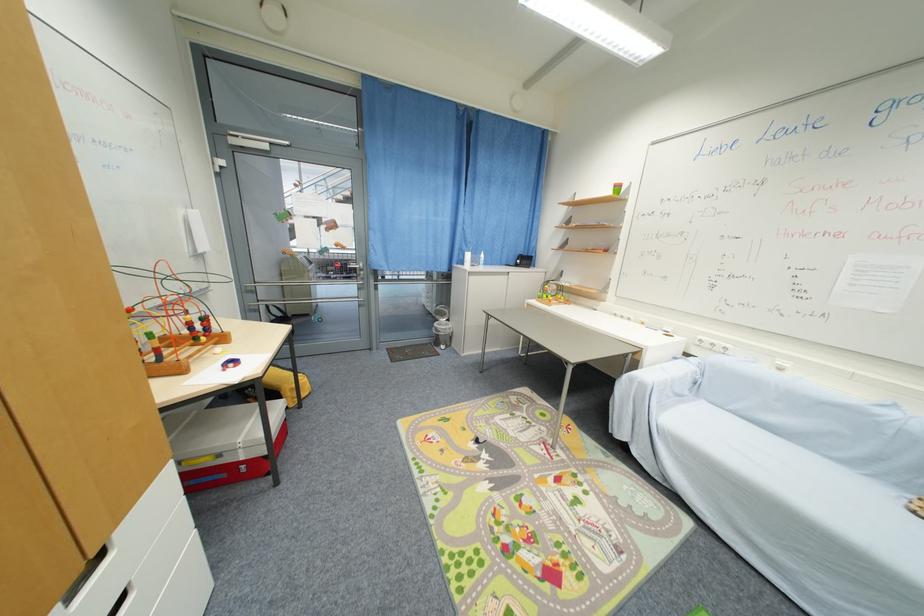
Find where to push the white dispenser pump. Please return your answer as a coordinate pair (x, y).

(467, 257)